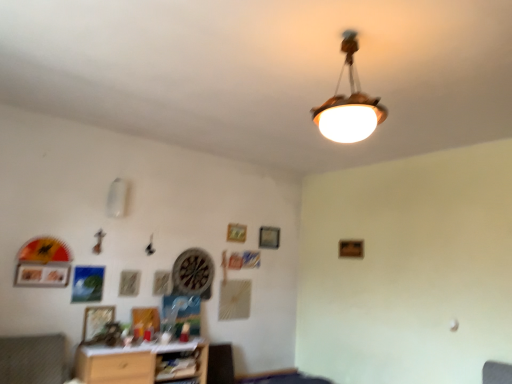
At what (x,y) coordinates should I click in order to perform the action: click on vacant point above wooden dartboard at center (from a real-world perspective). Please return your answer as a coordinate pair (x, y). Looking at the image, I should click on (193, 243).